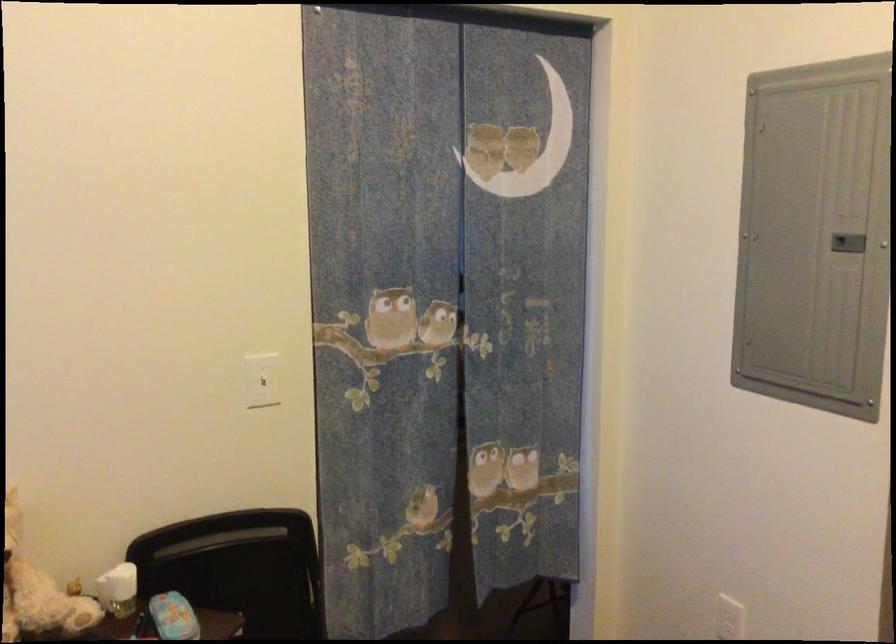
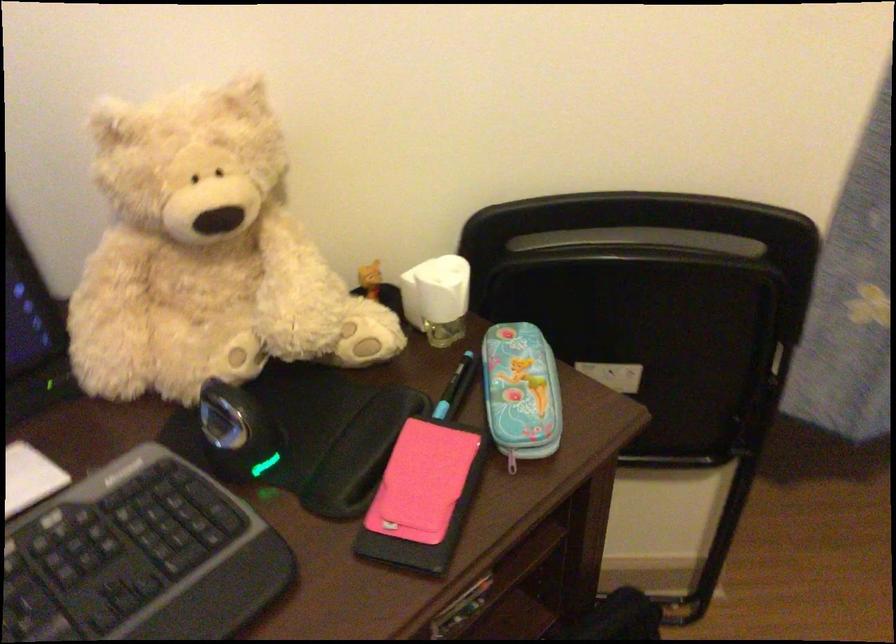
The images are taken continuously from a first-person perspective. In which direction is your viewpoint rotating?

The camera rotated toward left-down.